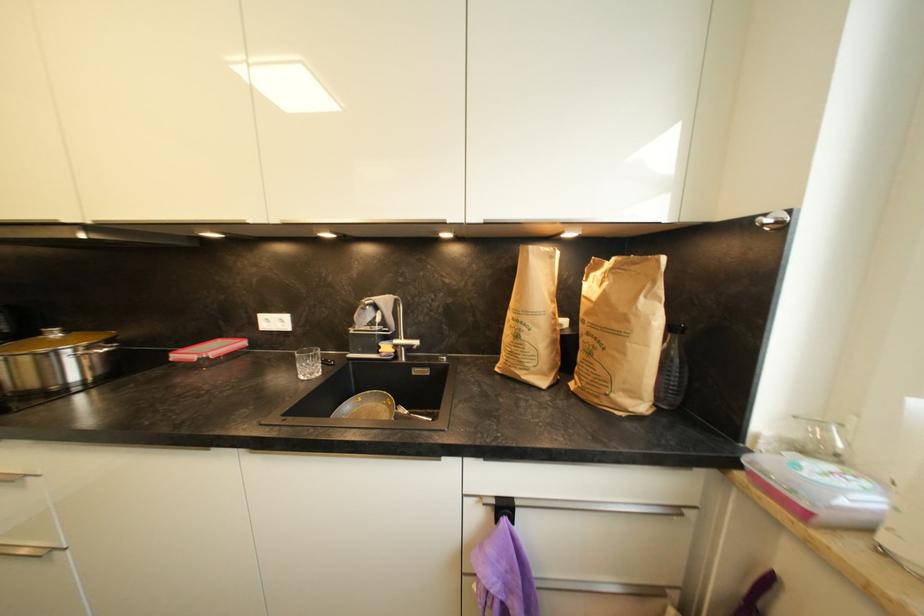
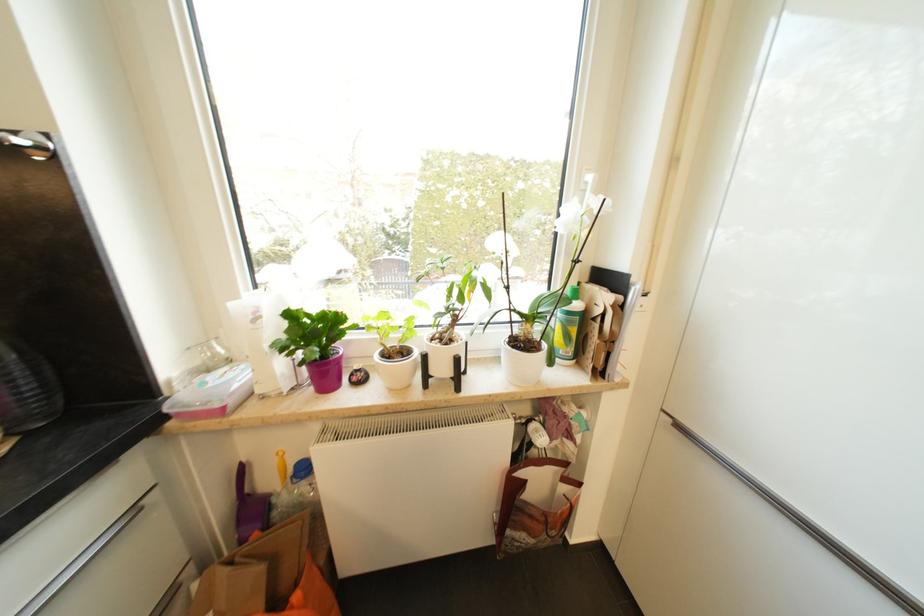
Find the pixel in the second image that matches point (686, 374) in the first image.

(37, 370)